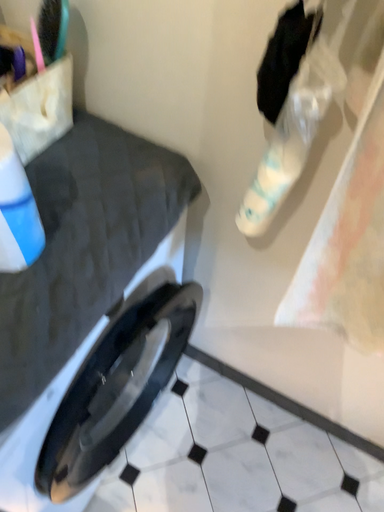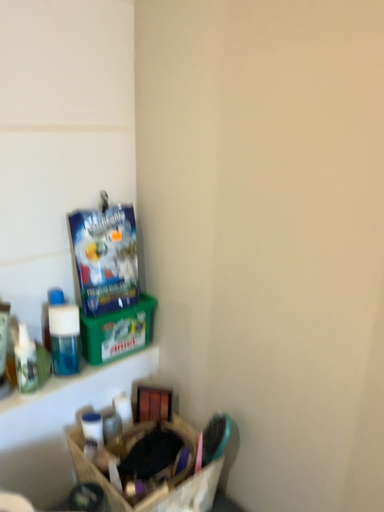
Question: Which way did the camera rotate in the video?

Choices:
 (A) rotated right
 (B) rotated left

Answer: (B)